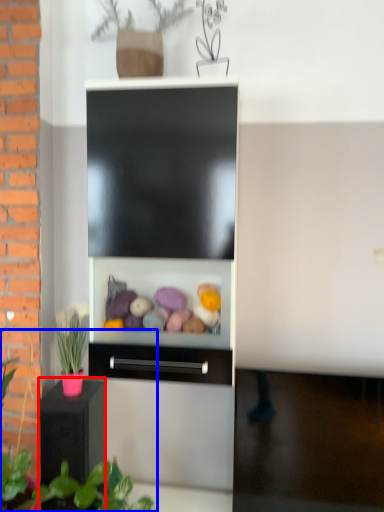
Question: Which point is further to the camera, furniture (highlighted by a red box) or plant (highlighted by a blue box)?

Choices:
 (A) furniture
 (B) plant

Answer: (A)